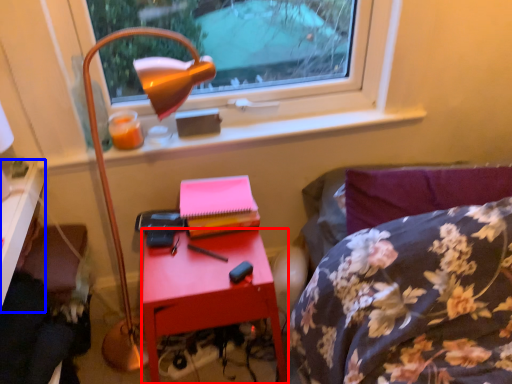
Question: Among these objects, which one is nearest to the camera, nightstand (highlighted by a red box) or desk (highlighted by a blue box)?

Choices:
 (A) nightstand
 (B) desk

Answer: (B)